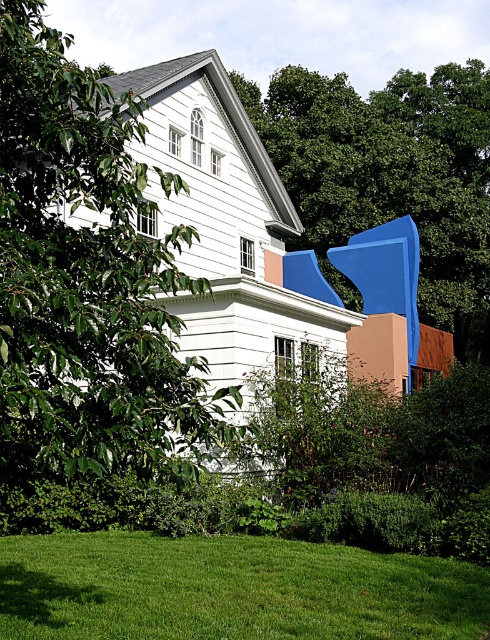
Question: Does green leafy tree at left have a smaller size compared to blue matte sculpture at upper right?

Choices:
 (A) yes
 (B) no

Answer: (A)

Question: Does green leafy tree at left have a lesser width compared to blue matte sculpture at upper right?

Choices:
 (A) no
 (B) yes

Answer: (B)

Question: Does green leafy tree at left appear over blue matte sculpture at upper right?

Choices:
 (A) yes
 (B) no

Answer: (B)

Question: Considering the real-world distances, which object is farthest from the green grass at lower center?

Choices:
 (A) blue matte sculpture at upper right
 (B) green leafy tree at left

Answer: (A)

Question: Which is nearer to the green grass at lower center?

Choices:
 (A) blue matte sculpture at upper right
 (B) green leafy tree at left

Answer: (B)

Question: Which point appears farthest from the camera in this image?

Choices:
 (A) (126, 456)
 (B) (323, 209)
 (C) (431, 566)

Answer: (B)